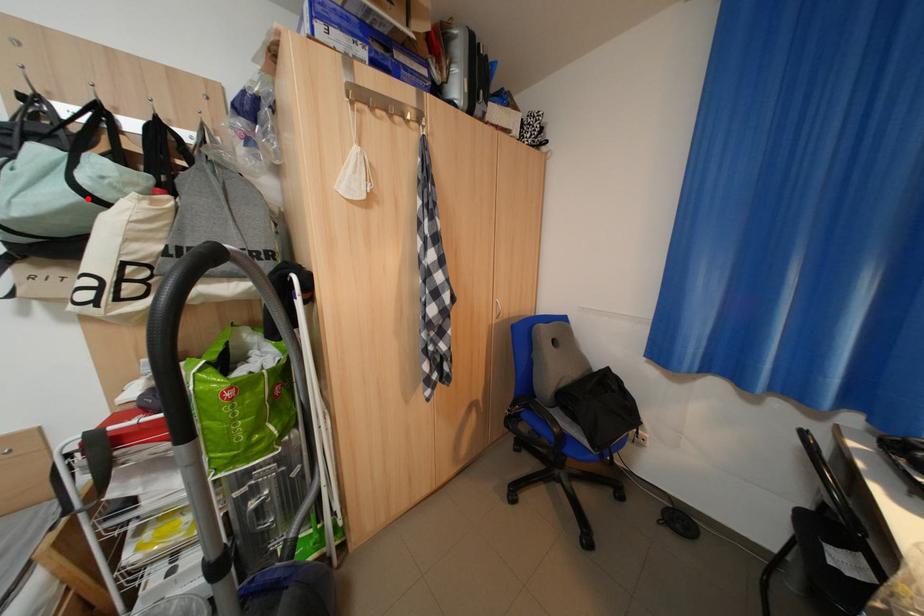
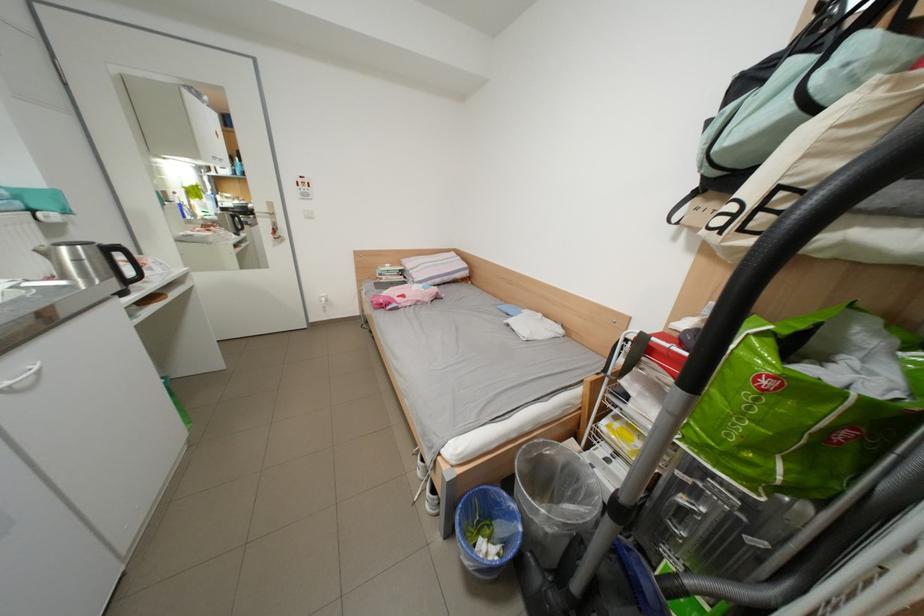
The point at the highlighted location is marked in the first image. Where is the corresponding point in the second image?

(801, 111)